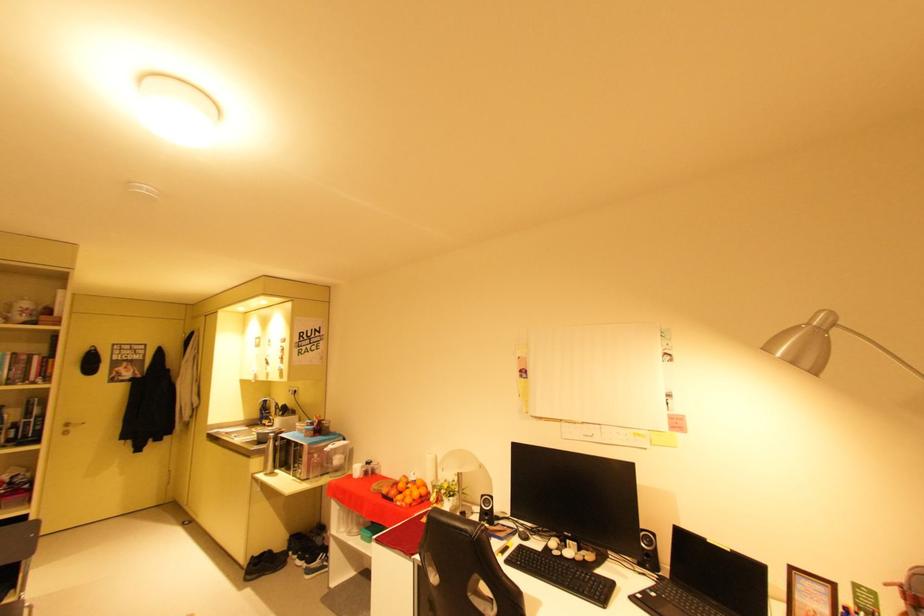
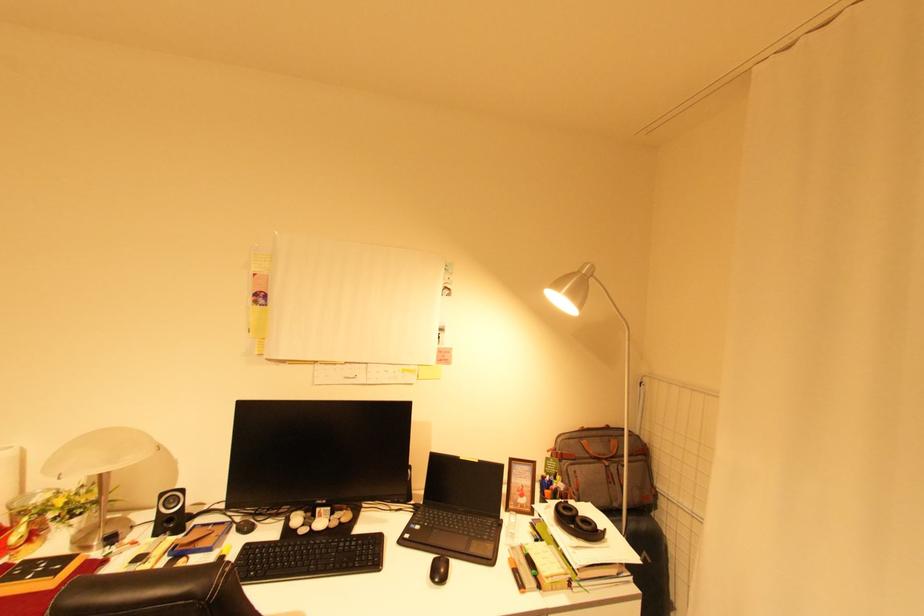
Locate, in the second image, the point that corresponds to pixel 817 323 in the first image.

(587, 273)